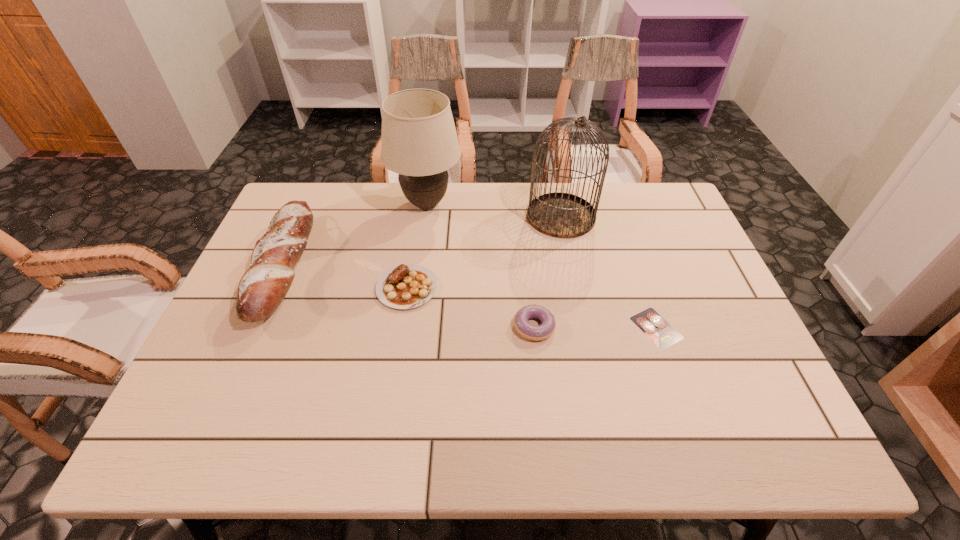
This screenshot has width=960, height=540. I want to click on lampshade, so click(x=419, y=141).

Identify the location of birdcage. (561, 215).

Identify the location of baguet. (264, 285).

Locate an element on the screen. Image resolution: width=960 pixels, height=540 pixels. the third tallest object is located at coordinates (264, 285).

The width and height of the screenshot is (960, 540). I want to click on doughnut, so click(x=536, y=333).

This screenshot has height=540, width=960. Identify the location of steak. (406, 286).

The width and height of the screenshot is (960, 540). In order to click on the rightmost object in this screenshot , I will do `click(653, 325)`.

Image resolution: width=960 pixels, height=540 pixels. Identify the location of salami. (653, 325).

Find the location of a particular element. This screenshot has height=540, width=960. vacant space situated 0.330m on the right of the lampshade is located at coordinates (564, 204).

This screenshot has height=540, width=960. In order to click on vacant space located on the front of the birdcage in this screenshot , I will do `click(579, 305)`.